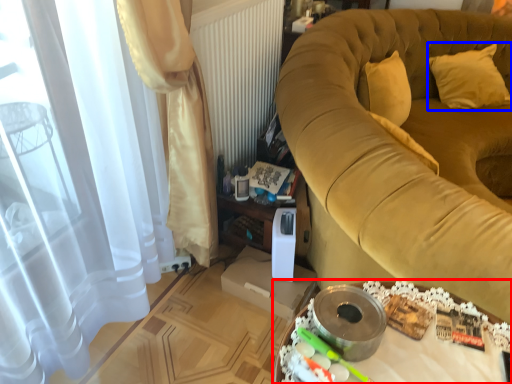
Question: Among these objects, which one is nearest to the camera, table (highlighted by a red box) or pillow (highlighted by a blue box)?

Choices:
 (A) table
 (B) pillow

Answer: (A)